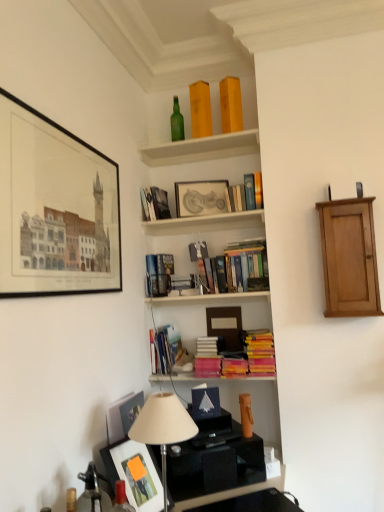
The height and width of the screenshot is (512, 384). What are the coordinates of `vacant space that's between matte silver picture frame at center, which is the 1th picture frame from back to front, and hardcover book at upper center, which is the 7th book in bottom-to-top order` in the screenshot? It's located at (190, 222).